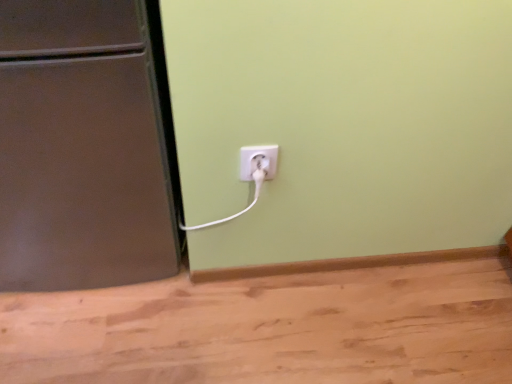
Question: Should I look upward or downward to see white plastic plug at lower center?

Choices:
 (A) up
 (B) down

Answer: (A)